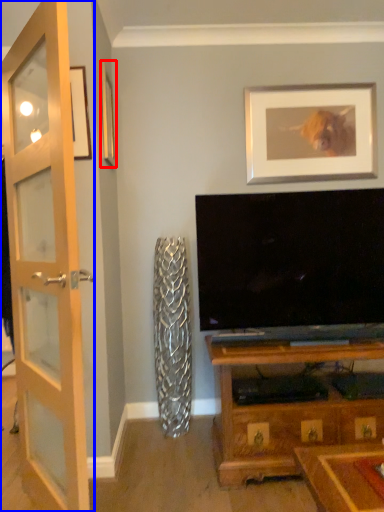
Question: Which point is further to the camera, picture frame (highlighted by a red box) or door (highlighted by a blue box)?

Choices:
 (A) picture frame
 (B) door

Answer: (A)